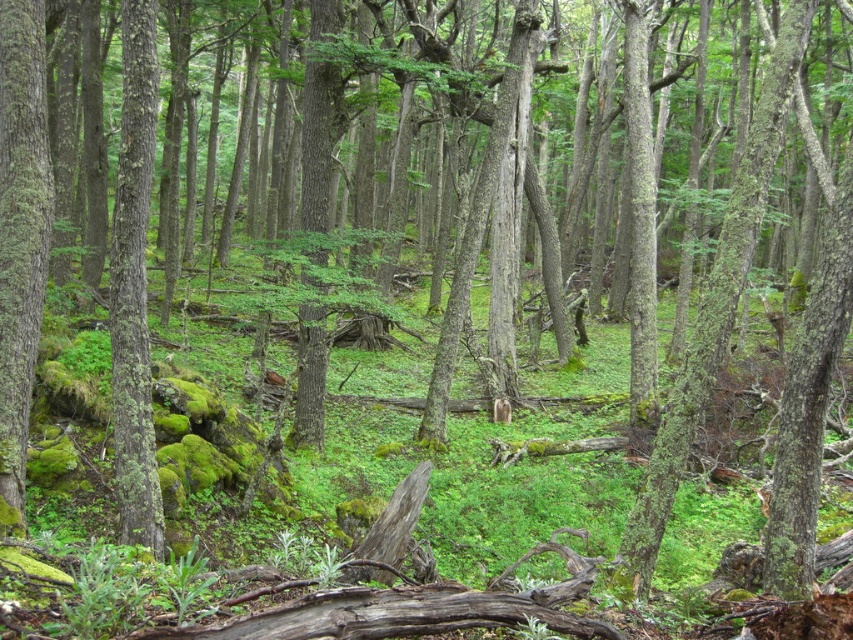
Question: Which point is closer to the camera?

Choices:
 (A) green mossy bark tree trunk at left
 (B) green mossy bark at left

Answer: (B)

Question: Does green mossy bark at left come behind green mossy bark tree trunk at left?

Choices:
 (A) yes
 (B) no

Answer: (B)

Question: Can you confirm if green mossy bark at left is positioned above green mossy bark tree trunk at left?

Choices:
 (A) no
 (B) yes

Answer: (B)

Question: Where is green mossy bark at left located in relation to green mossy bark tree trunk at left in the image?

Choices:
 (A) above
 (B) below

Answer: (A)

Question: Which object appears closest to the camera in this image?

Choices:
 (A) green mossy bark tree trunk at left
 (B) green mossy bark at left

Answer: (B)